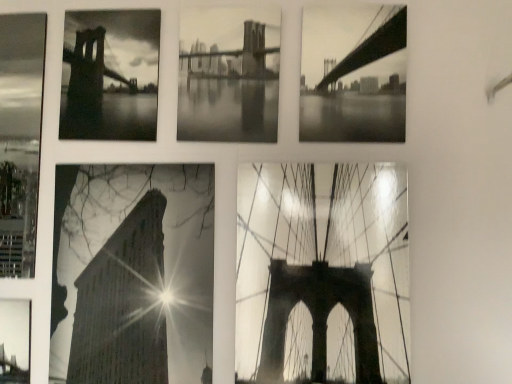
Question: Is monochrome bridge at upper right, the sixth picture frame in the left-to-right sequence, situated inside high contrast paper building at bottom left, the 3th picture frame in the left-to-right sequence, or outside?

Choices:
 (A) inside
 (B) outside

Answer: (B)

Question: In terms of height, does monochrome bridge at upper right, the sixth picture frame in the left-to-right sequence, look taller or shorter compared to high contrast paper building at bottom left, the 4th picture frame in the right-to-left sequence?

Choices:
 (A) tall
 (B) short

Answer: (B)

Question: Based on their relative distances, which object is farther from the metallic bridge at bottom left, which is the 6th picture frame in right-to-left order?

Choices:
 (A) monochrome bridge at upper right, arranged as the 1th picture frame when viewed from the right
 (B) matte glass bridge at center, acting as the 2th picture frame starting from the right
 (C) monochrome bridge at upper left, which is the 2th picture frame in left-to-right order
 (D) high contrast paper building at bottom left, the 4th picture frame in the right-to-left sequence
 (E) monochrome paper brooklyn bridge at center, marked as the 3th picture frame in a right-to-left arrangement

Answer: (A)

Question: Which object is the farthest from the matte glass bridge at center, acting as the 2th picture frame starting from the right?

Choices:
 (A) monochrome paper brooklyn bridge at center, marked as the 3th picture frame in a right-to-left arrangement
 (B) monochrome bridge at upper right, arranged as the 1th picture frame when viewed from the right
 (C) monochrome bridge at upper left, positioned as the 5th picture frame in right-to-left order
 (D) metallic bridge at bottom left, which ranks as the first picture frame in left-to-right order
 (E) high contrast paper building at bottom left, the 3th picture frame in the left-to-right sequence

Answer: (D)